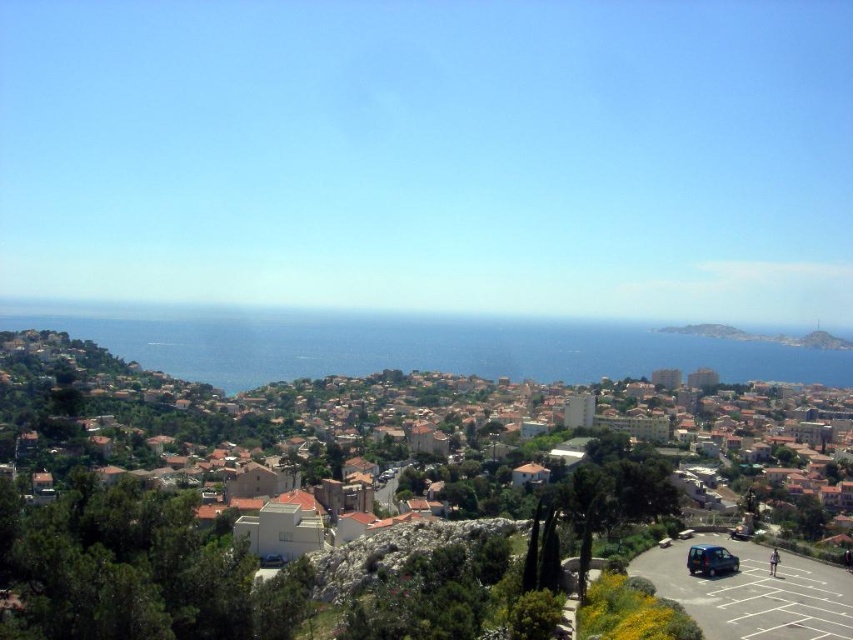
Is orange tiled roofs at center taller than blue water at center?

Correct, orange tiled roofs at center is much taller as blue water at center.

Find the location of a particular element. Image resolution: width=853 pixels, height=640 pixels. orange tiled roofs at center is located at coordinates (428, 432).

In order to click on orange tiled roofs at center in this screenshot , I will do `click(428, 432)`.

Can you confirm if orange tiled roofs at center is taller than metallic blue van at lower right?

Yes, orange tiled roofs at center is taller than metallic blue van at lower right.

Between orange tiled roofs at center and metallic blue van at lower right, which one appears on the right side from the viewer's perspective?

metallic blue van at lower right

Does point (521, 397) come closer to viewer compared to point (718, 560)?

That is False.

Where is `orange tiled roofs at center`? This screenshot has height=640, width=853. orange tiled roofs at center is located at coordinates (428, 432).

Can you confirm if blue water at center is thinner than metallic blue van at lower right?

In fact, blue water at center might be wider than metallic blue van at lower right.

Between blue water at center and metallic blue van at lower right, which one is positioned lower?

Positioned lower is metallic blue van at lower right.

I want to click on blue water at center, so click(413, 346).

In order to click on blue water at center in this screenshot , I will do [413, 346].